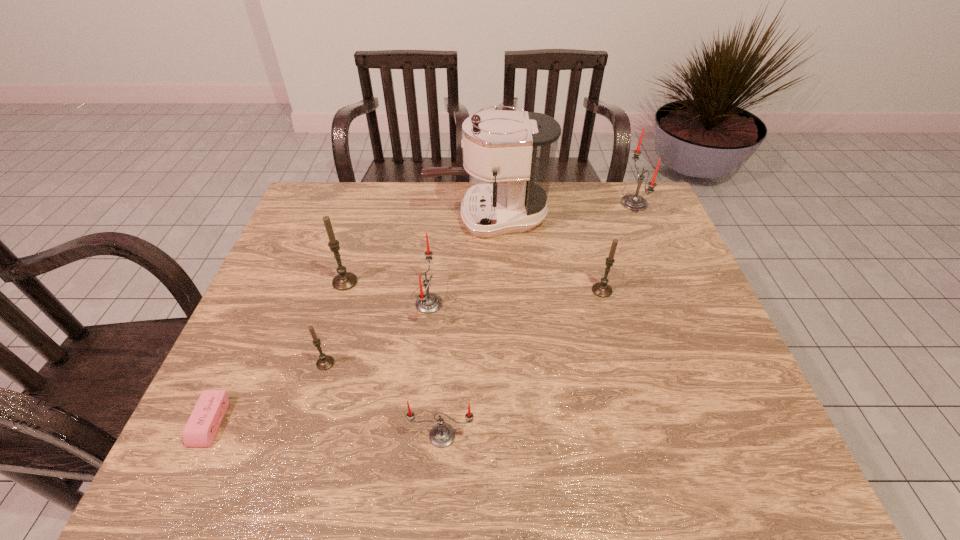
This screenshot has width=960, height=540. Identify the location of free space between the farthest red candle and the second smallest gray candle. (618, 247).

I want to click on free space between the nearest gray candle and the farthest red candle, so click(480, 283).

The width and height of the screenshot is (960, 540). I want to click on empty space between the second biggest red candle and the second nearest candle, so click(x=377, y=333).

Identify the location of free space between the biggest gray candle and the tallest object. This screenshot has width=960, height=540. (417, 249).

Identify the location of vacant space that is in between the biggest gray candle and the smallest gray candle. (335, 322).

Find the location of a particular element. The width and height of the screenshot is (960, 540). free point between the biggest gray candle and the coffee maker is located at coordinates (417, 249).

Locate an element on the screen. free spot between the second object from right to left and the second nearest candle is located at coordinates (464, 327).

Locate an element on the screen. This screenshot has height=540, width=960. free point between the rightmost candle and the rightmost gray candle is located at coordinates (618, 247).

Where is `object that is the fourth closest to the shortest object`? object that is the fourth closest to the shortest object is located at coordinates (426, 302).

Point out which object is positioned as the second nearest to the pink eraser. Please provide its 2D coordinates. Your answer should be formatted as a tuple, i.e. [(x, y)], where the tuple contains the x and y coordinates of a point satisfying the conditions above.

[(344, 280)]